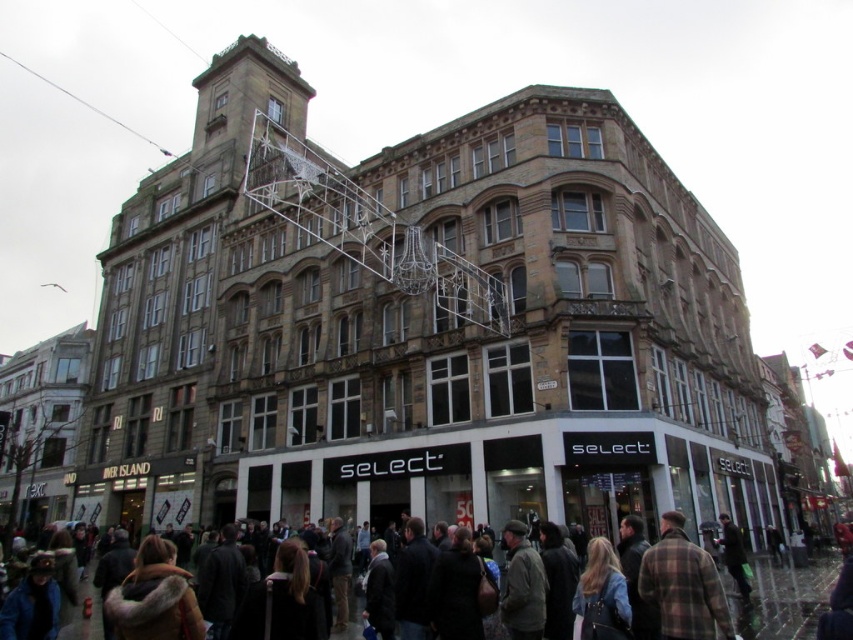
Question: Among these objects, which one is nearest to the camera?

Choices:
 (A) metallic silver scaffolding at upper center
 (B) dark brown leather jackets at lower center

Answer: (B)

Question: Can you confirm if metallic silver scaffolding at upper center is positioned to the left of dark brown leather jackets at lower center?

Choices:
 (A) yes
 (B) no

Answer: (B)

Question: Does metallic silver scaffolding at upper center have a larger size compared to dark brown leather jackets at lower center?

Choices:
 (A) no
 (B) yes

Answer: (B)

Question: Does metallic silver scaffolding at upper center have a larger size compared to dark brown leather jackets at lower center?

Choices:
 (A) no
 (B) yes

Answer: (B)